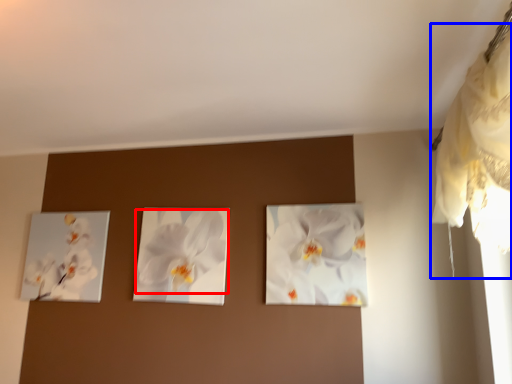
Question: Among these objects, which one is nearest to the camera, flower (highlighted by a red box) or curtain (highlighted by a blue box)?

Choices:
 (A) flower
 (B) curtain

Answer: (B)